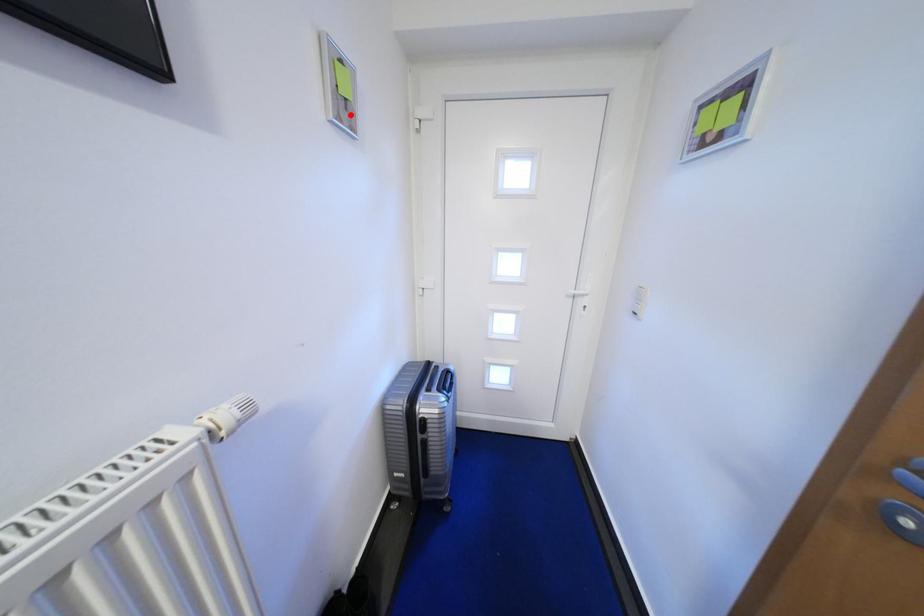
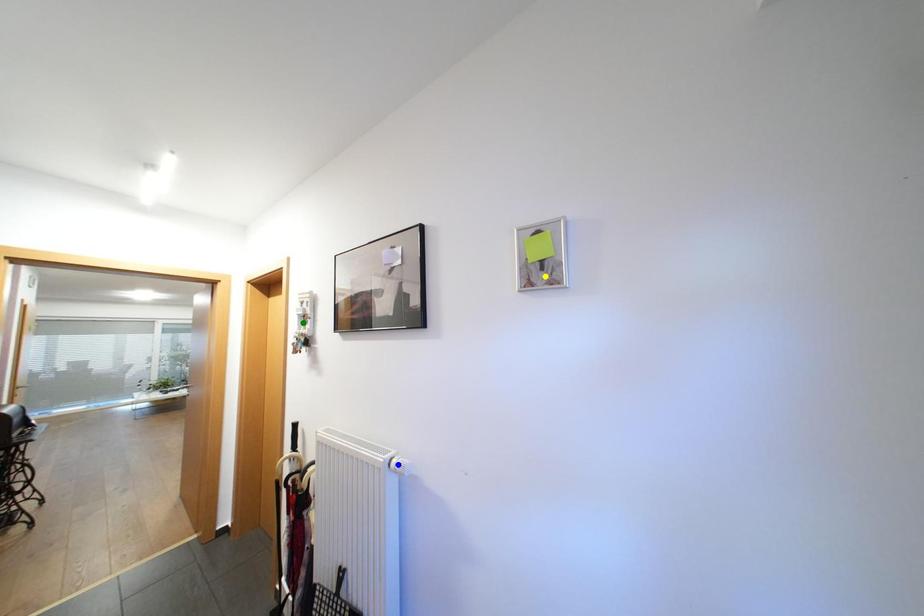
Question: I am providing you with two images of the same scene from different viewpoints. A red point is marked on the first image. You are given multiple points on the second image. Which mark in image 2 goes with the point in image 1?

Choices:
 (A) green point
 (B) yellow point
 (C) blue point

Answer: (B)